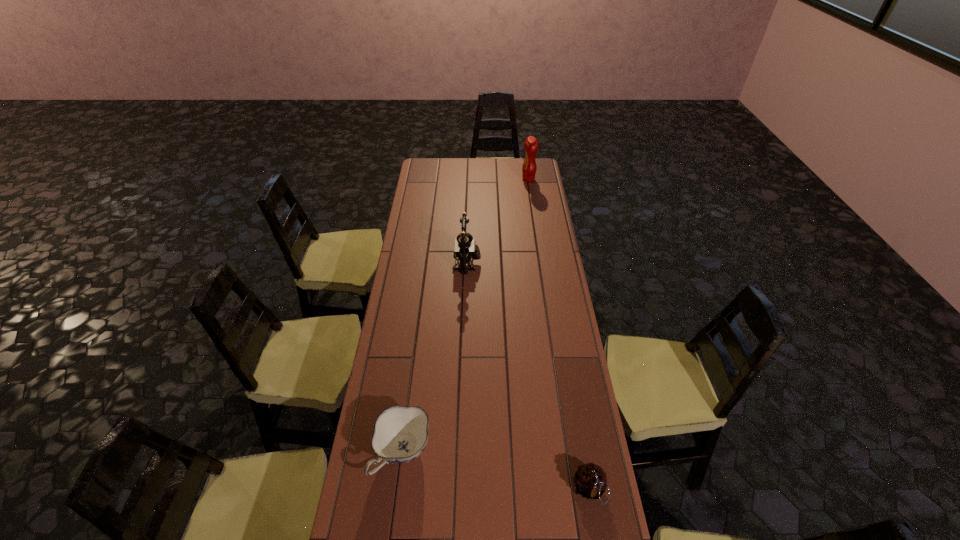
Identify the location of vacant space located 0.050m with a leaf charm attached to the pinecone. The height and width of the screenshot is (540, 960). (596, 530).

This screenshot has height=540, width=960. I want to click on object that is at the far edge, so click(531, 145).

Locate an element on the screen. object located at the left edge is located at coordinates (400, 435).

Image resolution: width=960 pixels, height=540 pixels. I want to click on condiment located in the right edge section of the desktop, so tap(531, 145).

At what (x,y) coordinates should I click in order to perform the action: click on pinecone that is at the right edge. Please return your answer as a coordinate pair (x, y). The width and height of the screenshot is (960, 540). Looking at the image, I should click on (590, 480).

Find the location of a particular element. object situated at the far right corner is located at coordinates (531, 145).

At what (x,y) coordinates should I click in order to perform the action: click on vacant space at the far edge of the desktop. Please return your answer as a coordinate pair (x, y). The height and width of the screenshot is (540, 960). Looking at the image, I should click on (501, 166).

I want to click on free space at the left edge of the desktop, so [434, 228].

Image resolution: width=960 pixels, height=540 pixels. Identify the location of vacant region at the right edge of the desktop. (597, 447).

Identify the location of unoccupied area between the chinaware and the third object from right to left. The height and width of the screenshot is (540, 960). [x=435, y=358].